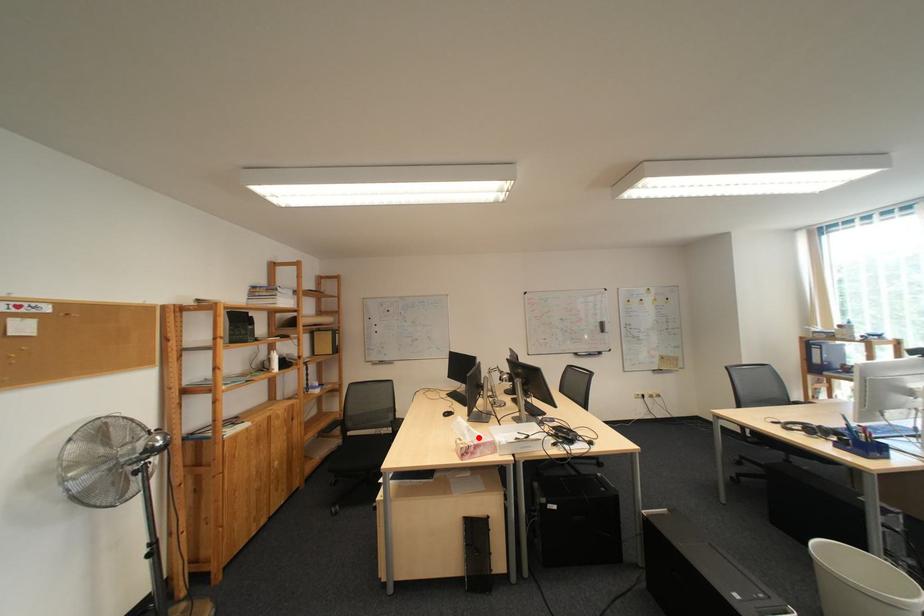
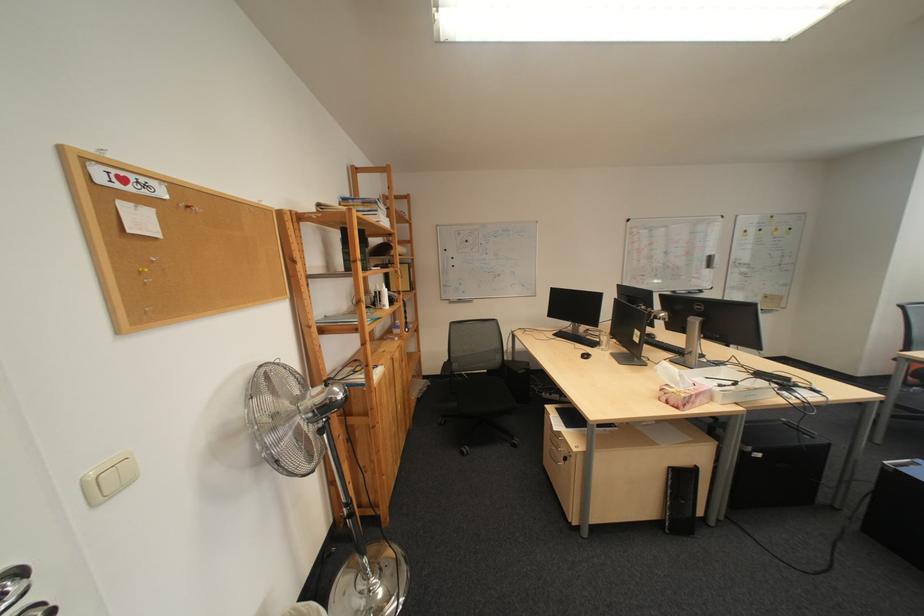
The point at the highlighted location is marked in the first image. Where is the corresponding point in the second image?

(690, 385)